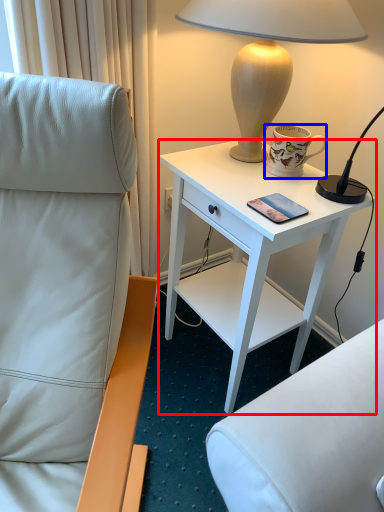
Question: Which object is closer to the camera taking this photo, desk (highlighted by a red box) or coffee cup (highlighted by a blue box)?

Choices:
 (A) desk
 (B) coffee cup

Answer: (A)